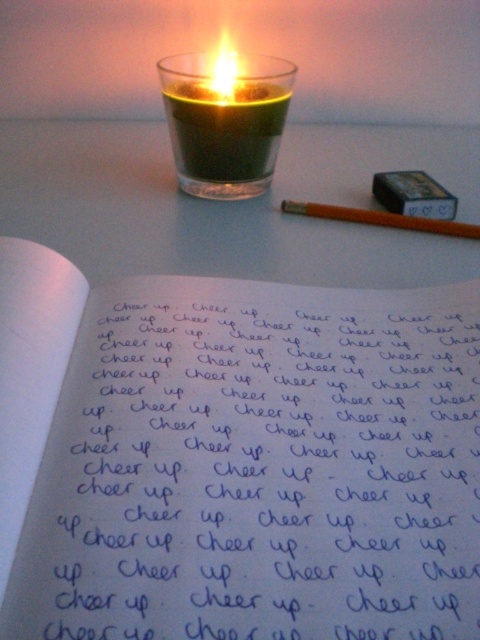
You need to decide whether to place a small 5cm wide paperweight on the blue ink notebook at center or the orange wood pencil at upper right. Which object can definitely fit the paperweight without overlapping?

The blue ink notebook at center is bigger than orange wood pencil at upper right, so the paperweight can definitely fit on the blue ink notebook at center without overlapping.

You are an interior designer planning to place a decorative candle holder in the center of the room. The current scene has a blue ink notebook at center. Can you place the candle holder at the center without moving the notebook?

The blue ink notebook at center is already occupying the center position at point coordinates (236, 458), so placing the candle holder there would require moving the notebook.